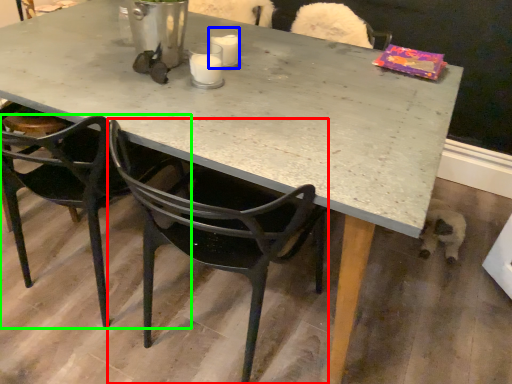
Question: Which is nearer to the chair (highlighted by a red box)? coffee cup (highlighted by a blue box) or chair (highlighted by a green box).

Choices:
 (A) coffee cup
 (B) chair

Answer: (B)